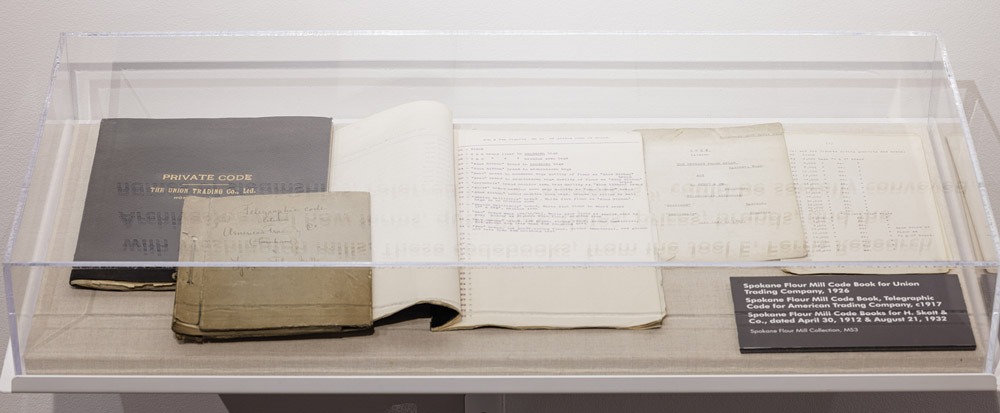
Find the location of a particular element. This screenshot has width=1000, height=413. cloth mat is located at coordinates (679, 355).